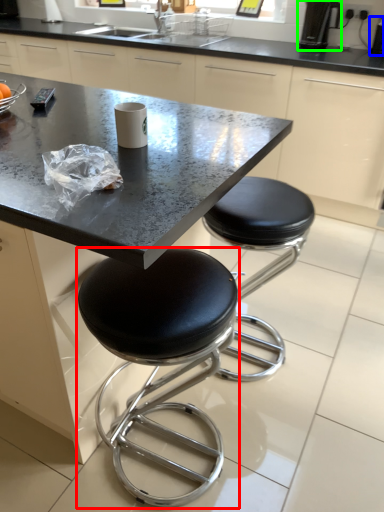
Question: Which is nearer to the stool (highlighted by a red box)? appliance (highlighted by a blue box) or coffee machine (highlighted by a green box).

Choices:
 (A) appliance
 (B) coffee machine

Answer: (B)